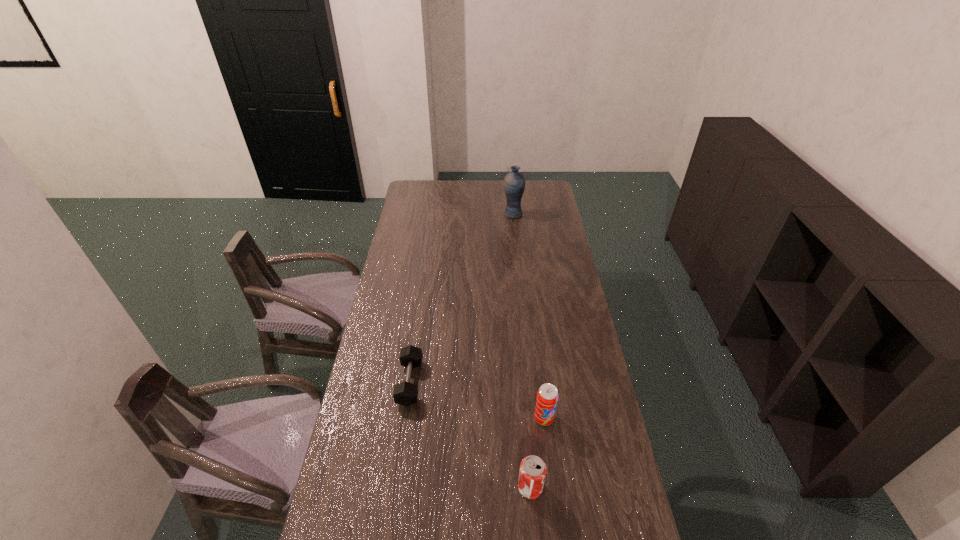
Where is `the farthest object`? Image resolution: width=960 pixels, height=540 pixels. the farthest object is located at coordinates (514, 182).

At what (x,y) coordinates should I click in order to perform the action: click on the tallest object. Please return your answer as a coordinate pair (x, y). This screenshot has height=540, width=960. Looking at the image, I should click on (514, 182).

Where is `the farther soda can`? This screenshot has width=960, height=540. the farther soda can is located at coordinates (547, 396).

The image size is (960, 540). What are the coordinates of `the nearer soda can` in the screenshot? It's located at (532, 473).

Where is `the third nearest object`? This screenshot has height=540, width=960. the third nearest object is located at coordinates (405, 393).

What are the coordinates of `dumbbell` in the screenshot? It's located at (405, 393).

Locate an element on the screen. free space located 0.080m on the back of the tallest object is located at coordinates (512, 201).

Where is `vacant space located 0.090m on the back of the third farthest object`? vacant space located 0.090m on the back of the third farthest object is located at coordinates pyautogui.click(x=540, y=387).

Locate an element on the screen. This screenshot has width=960, height=540. vacant area situated on the back of the nearest object is located at coordinates (526, 444).

Locate an element on the screen. This screenshot has width=960, height=540. free region located on the back of the second farthest object is located at coordinates (422, 294).